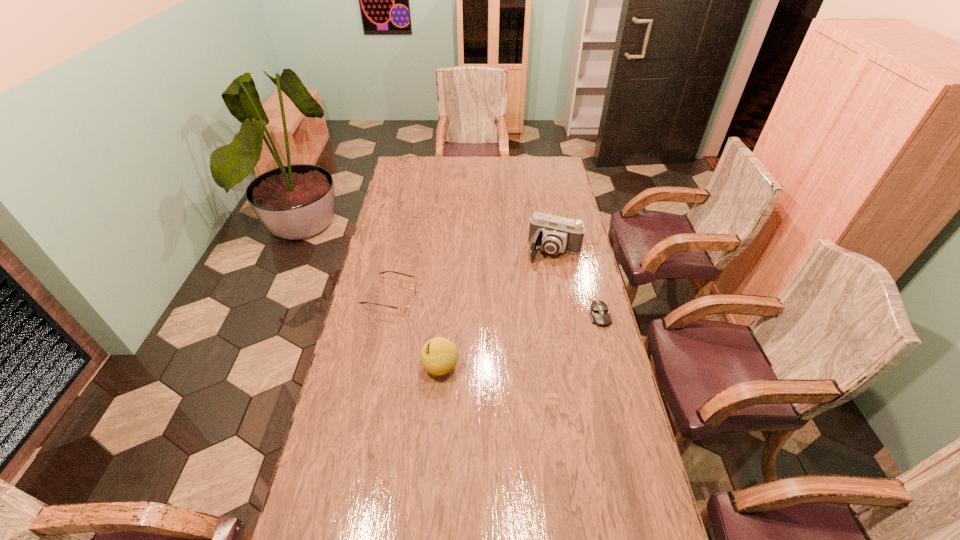
In order to click on the second tallest object in this screenshot , I will do `click(439, 355)`.

At what (x,y) coordinates should I click in order to perform the action: click on softball. Please return your answer as a coordinate pair (x, y). The image size is (960, 540). Looking at the image, I should click on (439, 355).

Locate an element on the screen. the shortest object is located at coordinates (599, 314).

Locate an element on the screen. The height and width of the screenshot is (540, 960). the tallest object is located at coordinates (553, 234).

Where is `the farthest object`? the farthest object is located at coordinates (553, 234).

Locate an element on the screen. the leftmost object is located at coordinates (403, 307).

Where is `spectacles`? This screenshot has height=540, width=960. spectacles is located at coordinates (403, 307).

I want to click on vacant region located 0.170m on the logo side of the third object from right to left, so click(372, 367).

Identify the location of free region located on the logo side of the third object from right to left. The height and width of the screenshot is (540, 960). (398, 367).

Find the location of a particular element. Image resolution: width=960 pixels, height=540 pixels. vacant space situated on the logo side of the third object from right to left is located at coordinates (389, 367).